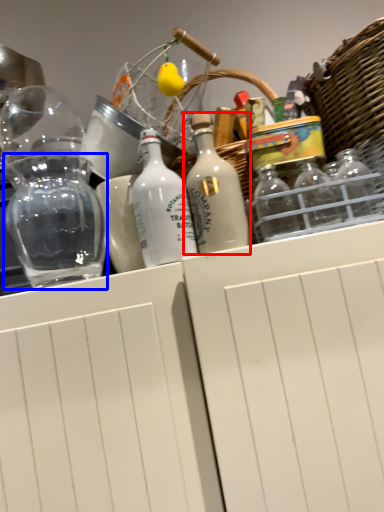
Question: Which point is closer to the camera, bottle (highlighted by a red box) or glass jar (highlighted by a blue box)?

Choices:
 (A) bottle
 (B) glass jar

Answer: (A)